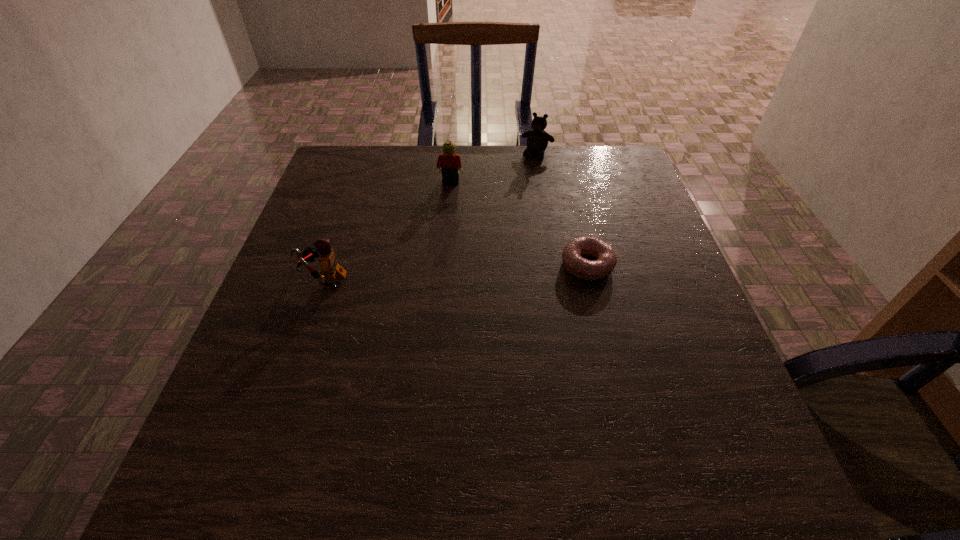
Locate an element on the screen. The image size is (960, 540). vacant spot on the desktop that is between the leftmost object and the doughnut and is positioned on the face of the right Lego is located at coordinates (428, 273).

The image size is (960, 540). Identify the location of vacant space on the desktop that is between the nearer Lego and the doughnut and is positioned at the face of the farthest object. (483, 271).